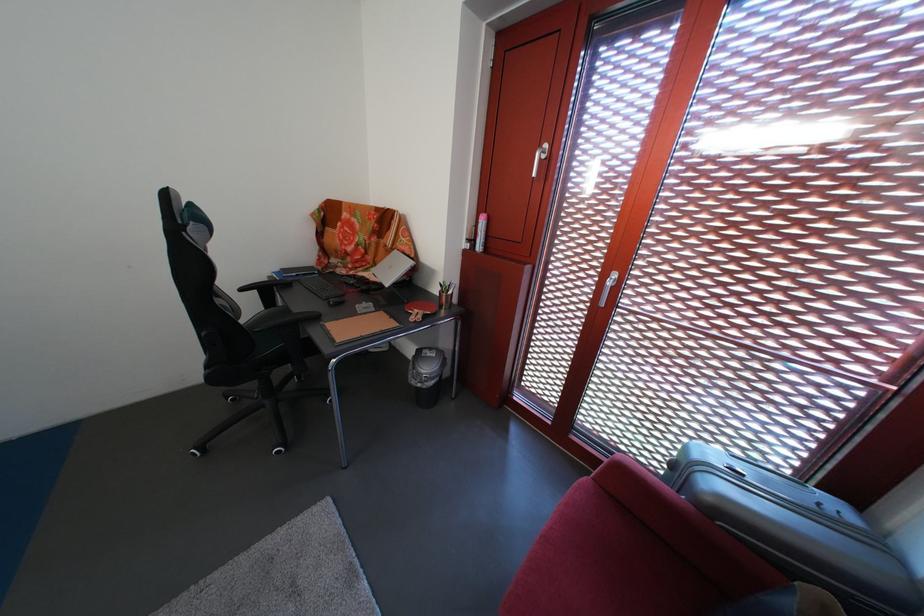
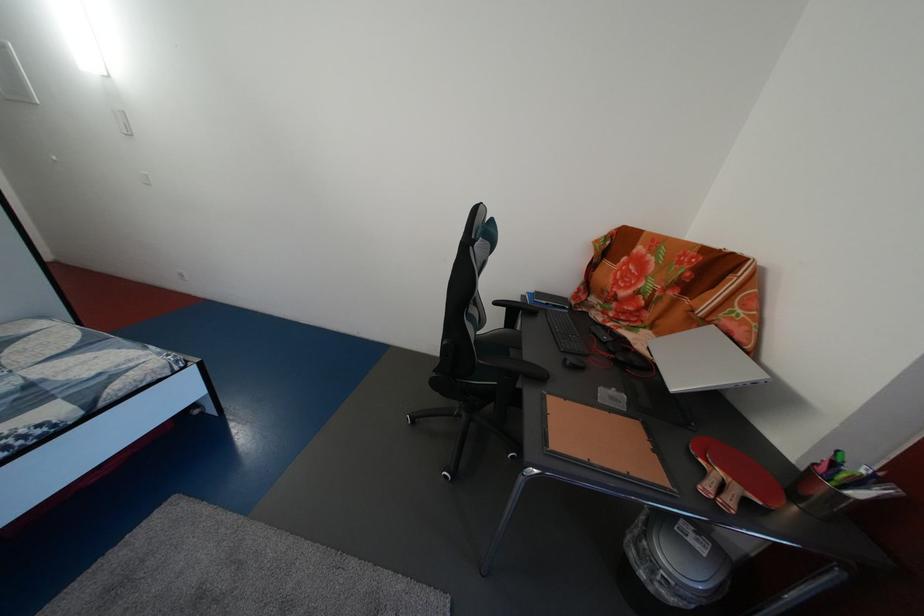
Locate, in the second image, the point that corresponds to (x=432, y=318) in the first image.

(748, 496)